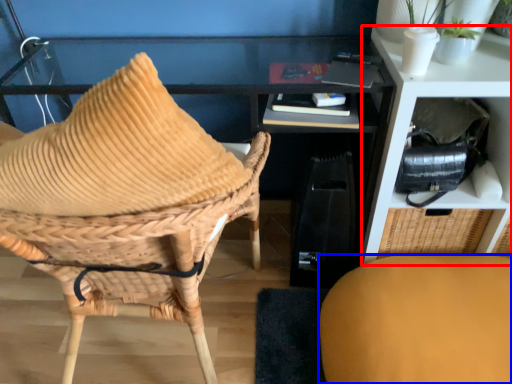
Question: Which of the following is the closest to the observer, shelf (highlighted by a red box) or chair (highlighted by a blue box)?

Choices:
 (A) shelf
 (B) chair

Answer: (B)